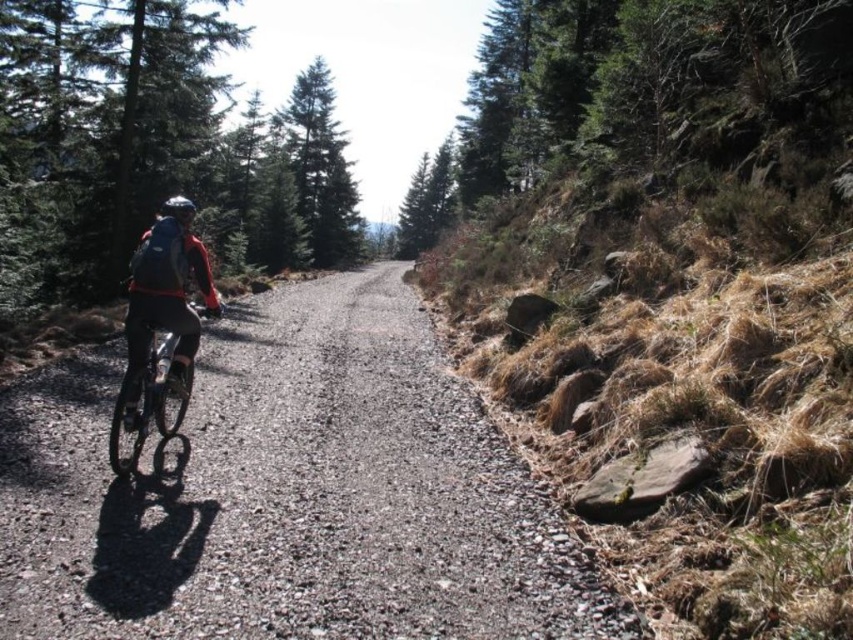
Is green textured tree at right taller than matte black helmet at left?

Yes, green textured tree at right is taller than matte black helmet at left.

Who is more distant from viewer, (682, 141) or (175, 195)?

Point (175, 195)

Identify the location of green textured tree at right. The height and width of the screenshot is (640, 853). (637, 99).

Can you confirm if gray gravel path at center is shorter than matte black helmet at left?

Indeed, gray gravel path at center has a lesser height compared to matte black helmet at left.

Identify the location of gray gravel path at center. The image size is (853, 640). (288, 493).

Identify the location of gray gravel path at center. The image size is (853, 640). point(288,493).

Is matte black jacket at center positioned at the back of shiny metallic bicycle at left?

That is True.

Can you confirm if matte black jacket at center is thinner than shiny metallic bicycle at left?

Yes, matte black jacket at center is thinner than shiny metallic bicycle at left.

Between point (209, 304) and point (129, 420), which one is positioned behind?

The point (209, 304) is more distant.

Find the location of a particular element. matte black jacket at center is located at coordinates pyautogui.click(x=164, y=305).